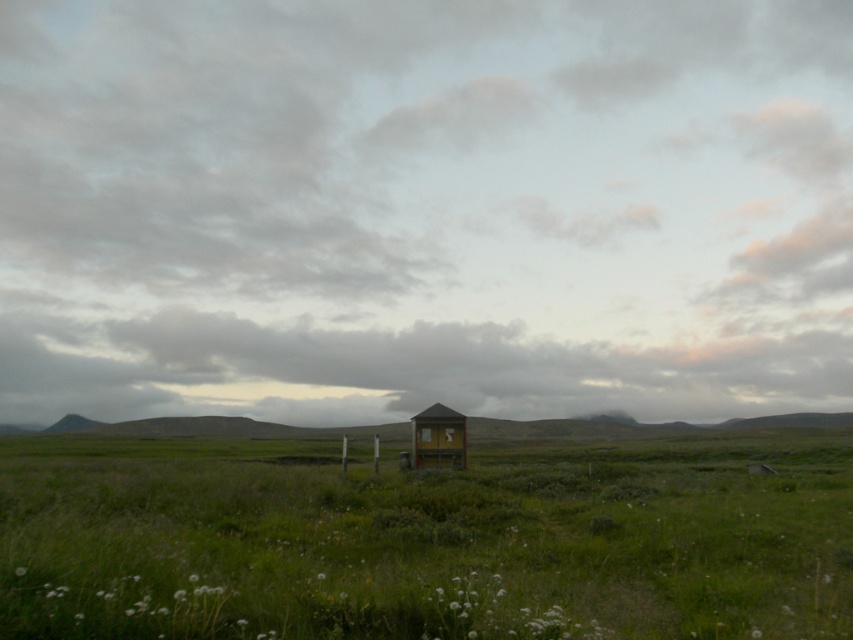
You are standing in the middle of the green grassy field at center and looking towards the wooden cabin at center. Which direction should you walk to reach the cabin?

Since the green grassy field at center is below the wooden cabin at center, you should walk upwards to reach the cabin.

You are standing at the origin point in the landscape. You want to walk to the green grassy field at center. In which direction should you head based on the coordinates provided?

The green grassy field at center is located at point 0.845 in the x and 0.498 in the y. Since the origin is at the bottom left corner, you should head northeast to reach it.